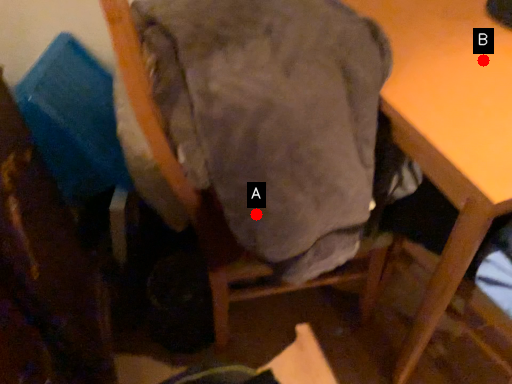
Question: Two points are circled on the image, labeled by A and B beside each circle. Which point is further to the camera?

Choices:
 (A) A is further
 (B) B is further

Answer: (B)